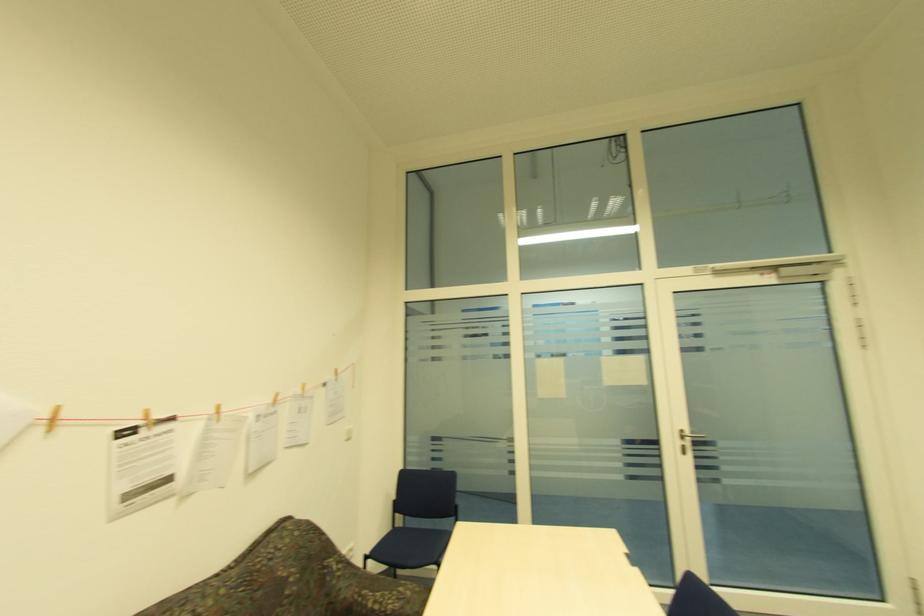
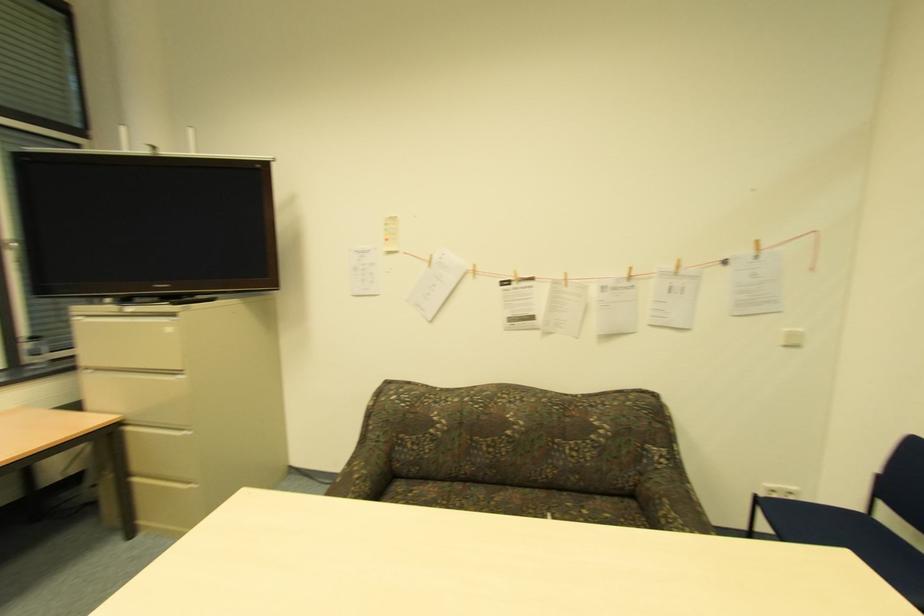
The point at (x=351, y=431) is marked in the first image. Where is the corresponding point in the second image?

(792, 334)